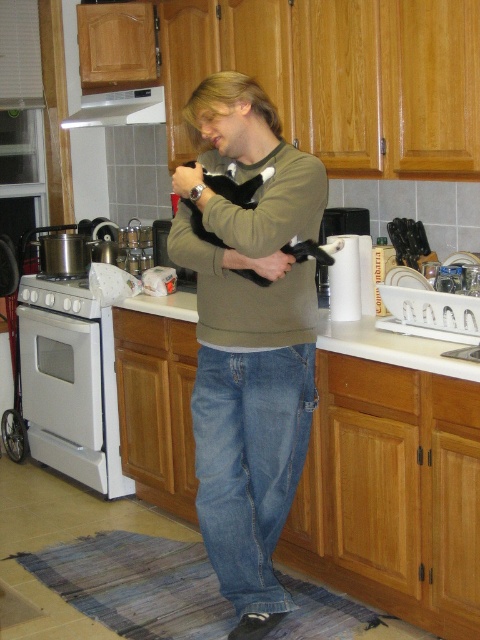
Which is in front, point (452, 360) or point (453, 355)?

Positioned in front is point (452, 360).

Can you confirm if white glossy counter top at center is positioned to the left of white ceramic sink at center?

Indeed, white glossy counter top at center is positioned on the left side of white ceramic sink at center.

Measure the distance between point (x=428, y=340) and camera.

A distance of 8.82 feet exists between point (x=428, y=340) and camera.

You are a GUI agent. You are given a task and a screenshot of the screen. Output one action in this format:
    pyautogui.click(x=<x>, y=<y>)
    Task: Click on the white glossy counter top at center
    Image resolution: width=480 pixels, height=640 pixels.
    Given the screenshot: What is the action you would take?
    pyautogui.click(x=392, y=348)

Is point (204, 154) farther from camera compared to point (60, 454)?

No.

Which of these two, soft green sweater at center or white glossy oven at lower left, stands taller?

soft green sweater at center

Who is more distant from viewer, (282, 198) or (69, 348)?

The point (69, 348) is behind.

At what (x,y) coordinates should I click in order to perform the action: click on soft green sweater at center. Please return your answer as a coordinate pair (x, y). This screenshot has height=640, width=480. Looking at the image, I should click on (249, 339).

Who is positioned more to the left, soft green sweater at center or satin silver exhaust hood at upper center?

satin silver exhaust hood at upper center

Measure the distance between point (197, 372) and camera.

The distance of point (197, 372) from camera is 2.56 meters.

Between point (227, 486) and point (103, 99), which one is positioned in front?

Point (227, 486)

Locate an element on the screen. soft green sweater at center is located at coordinates (249, 339).